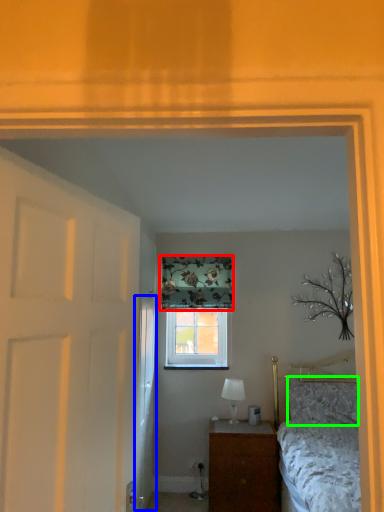
Question: Which is farther away from curtain (highlighted by a red box)? door (highlighted by a blue box) or pillow (highlighted by a green box)?

Choices:
 (A) door
 (B) pillow

Answer: (B)